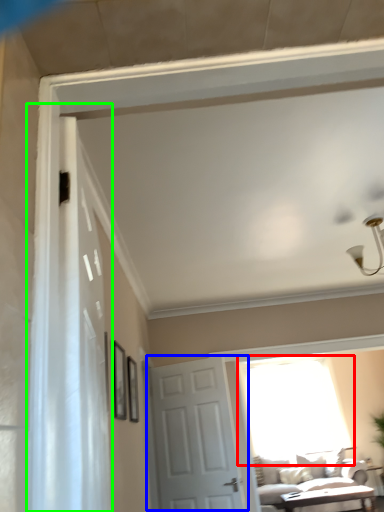
Question: Considering the real-world distances, which object is farthest from window (highlighted by a red box)? door (highlighted by a blue box) or shower curtain (highlighted by a green box)?

Choices:
 (A) door
 (B) shower curtain

Answer: (B)